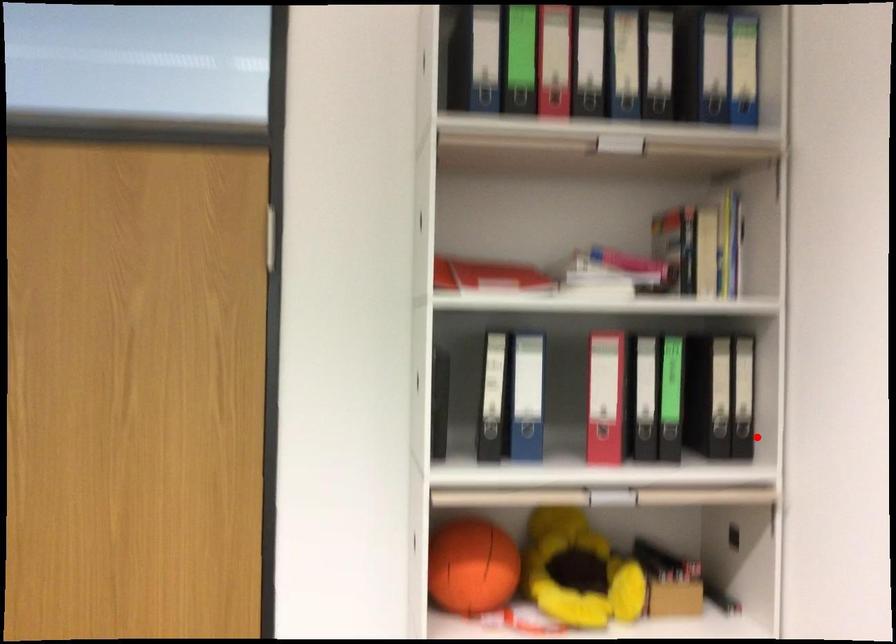
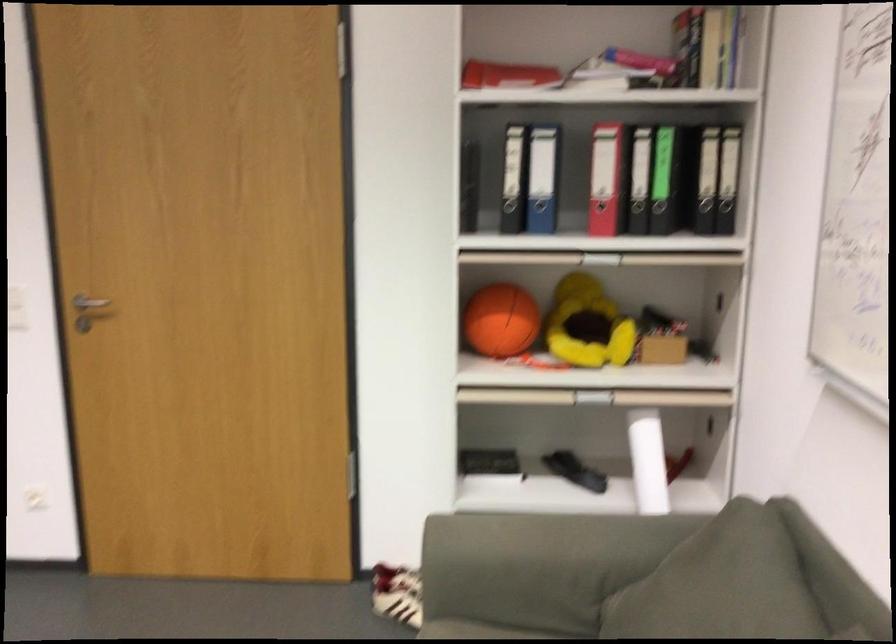
Question: I am providing you with two images of the same scene from different viewpoints. Image1 has a red point marked. In image2, the corresponding 3D location appears at what relative position? Reply with the corresponding letter.

Choices:
 (A) Closer
 (B) Farther

Answer: (B)